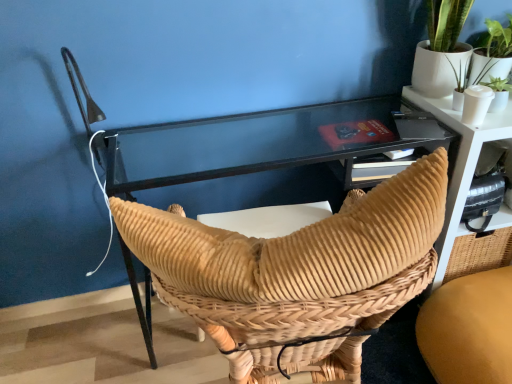
Question: Choose the correct answer: Is matte black table at upper right inside woven tan chair at center, which is the 2th chair in right-to-left order, or outside it?

Choices:
 (A) inside
 (B) outside

Answer: (B)

Question: Is matte black table at upper right in front of or behind woven tan chair at center, which is the 2th chair in right-to-left order, in the image?

Choices:
 (A) front
 (B) behind

Answer: (B)

Question: Estimate the real-world distances between objects in this image. Which object is farther from the woven tan chair at center, which is the 2th chair in right-to-left order?

Choices:
 (A) matte black table at upper right
 (B) brown woven chair at center, marked as the first chair in a right-to-left arrangement

Answer: (A)

Question: Considering the real-world distances, which object is farthest from the brown woven chair at center, the second chair in the left-to-right sequence?

Choices:
 (A) matte black table at upper right
 (B) woven tan chair at center, marked as the 1th chair in a left-to-right arrangement

Answer: (B)